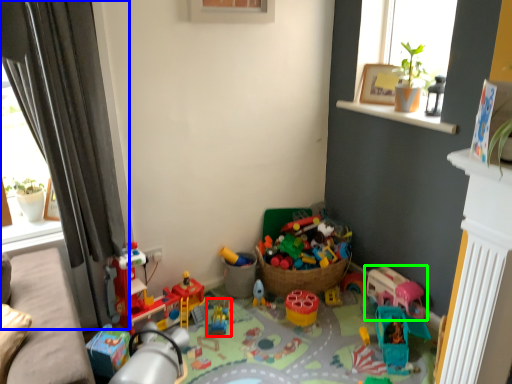
Question: Considering the real-world distances, which object is farthest from toy (highlighted by a red box)? curtain (highlighted by a blue box) or toy (highlighted by a green box)?

Choices:
 (A) curtain
 (B) toy

Answer: (A)